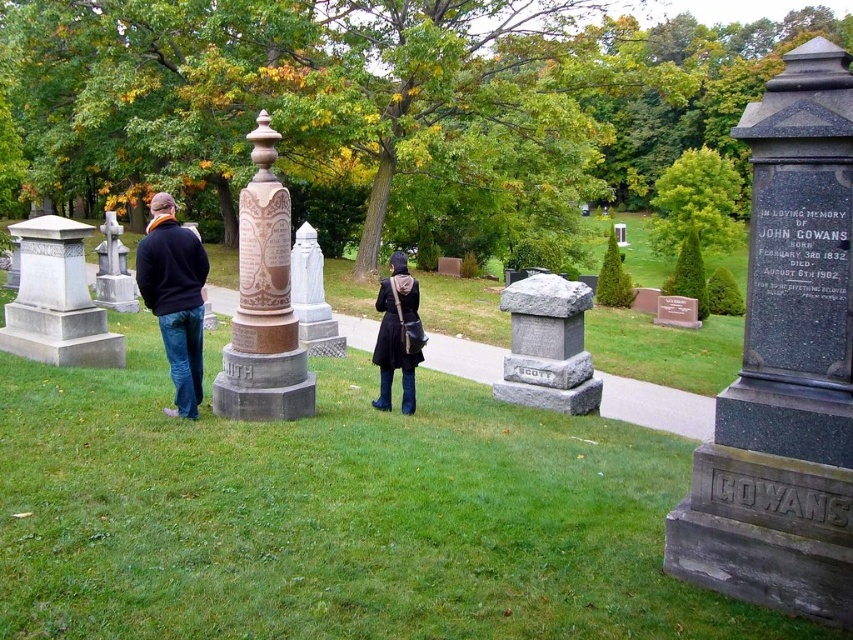
Does granite gravestone at right have a lesser height compared to gray stone gravestone at center?

Correct, granite gravestone at right is not as tall as gray stone gravestone at center.

At what (x,y) coordinates should I click in order to perform the action: click on granite gravestone at right. Please return your answer as a coordinate pair (x, y). Looking at the image, I should click on (785, 365).

Locate an element on the screen. granite gravestone at right is located at coordinates (785, 365).

Who is lower down, gray stone gravestone at center or dark brown leather jacket at center?

gray stone gravestone at center

Between gray stone gravestone at center and dark brown leather jacket at center, which one appears on the right side from the viewer's perspective?

Positioned to the right is gray stone gravestone at center.

Is point (541, 353) behind point (399, 291)?

That is True.

At what (x,y) coordinates should I click in order to perform the action: click on gray stone gravestone at center. Please return your answer as a coordinate pair (x, y). The image size is (853, 640). Looking at the image, I should click on (547, 346).

Who is positioned more to the left, gray stone monument at left or dark blue sweater at left?

gray stone monument at left is more to the left.

This screenshot has width=853, height=640. I want to click on gray stone monument at left, so click(57, 300).

Locate an element on the screen. The width and height of the screenshot is (853, 640). gray stone monument at left is located at coordinates (57, 300).